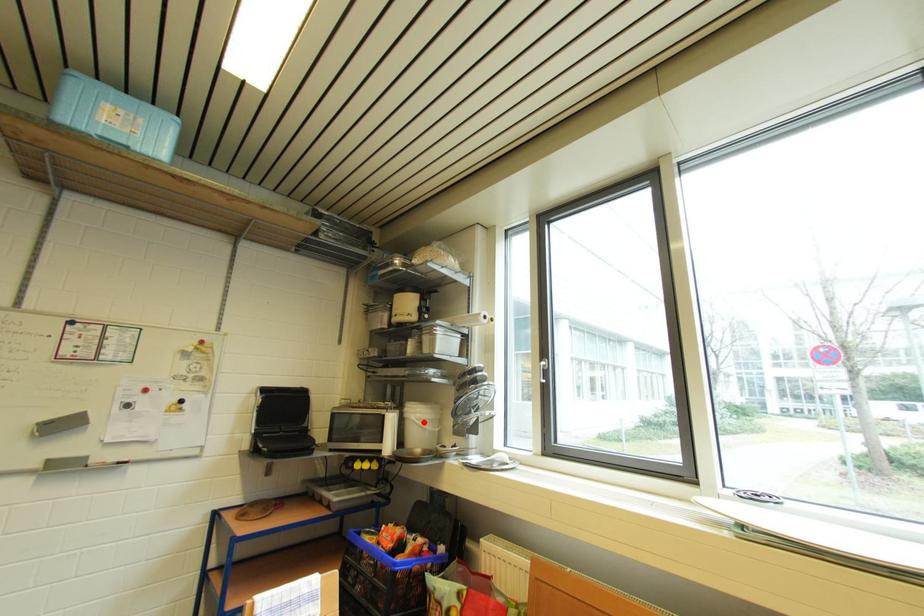
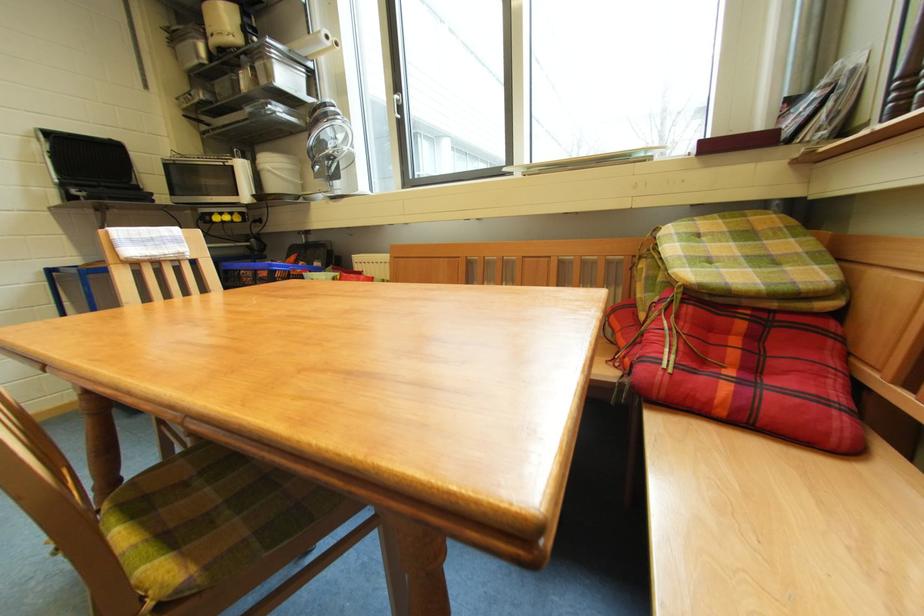
Question: I am providing you with two images of the same scene from different viewpoints. A red point is shown in image1. For the corresponding object point in image2, is it positioned nearer or farther from the camera?

Choices:
 (A) Nearer
 (B) Farther

Answer: (A)